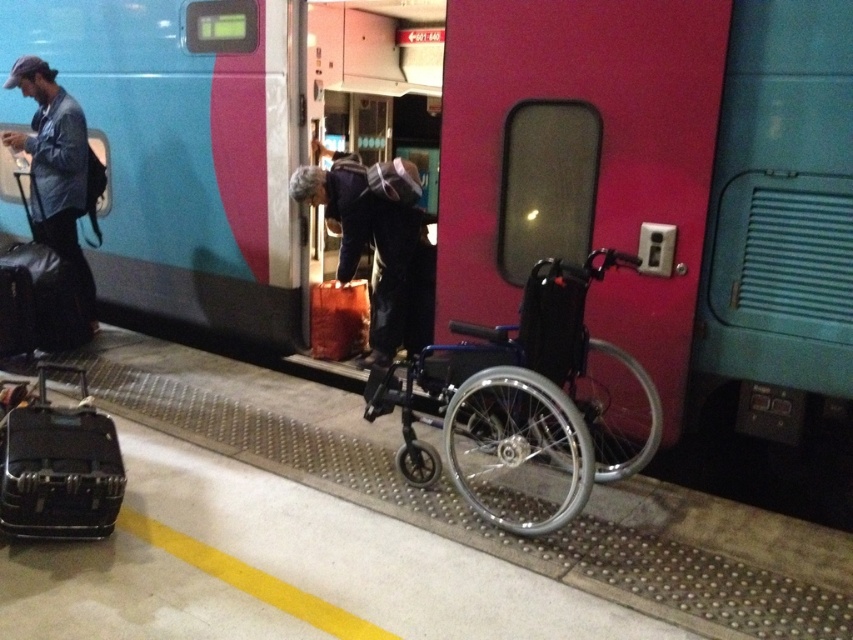
Is teal glossy train at center wider than blue metallic wheelchair at center?

Yes, teal glossy train at center is wider than blue metallic wheelchair at center.

Who is lower down, teal glossy train at center or blue metallic wheelchair at center?

blue metallic wheelchair at center is below.

Does point (96, 257) lie behind point (393, 374)?

Yes, it is behind point (393, 374).

Locate an element on the screen. teal glossy train at center is located at coordinates (498, 170).

Consider the image. Who is positioned more to the left, matte black suitcase at lower left or brown fabric bag at center?

Positioned to the left is matte black suitcase at lower left.

Who is shorter, matte black suitcase at lower left or brown fabric bag at center?

brown fabric bag at center

Who is more distant from viewer, (x=79, y=461) or (x=364, y=308)?

The point (x=364, y=308) is behind.

In order to click on matte black suitcase at lower left in this screenshot , I will do `click(59, 467)`.

Which of these two, blue metallic wheelchair at center or dark blue jacket at center, stands taller?

With more height is dark blue jacket at center.

Which is below, blue metallic wheelchair at center or dark blue jacket at center?

Positioned lower is blue metallic wheelchair at center.

Describe the element at coordinates (517, 396) in the screenshot. I see `blue metallic wheelchair at center` at that location.

This screenshot has height=640, width=853. I want to click on blue metallic wheelchair at center, so click(517, 396).